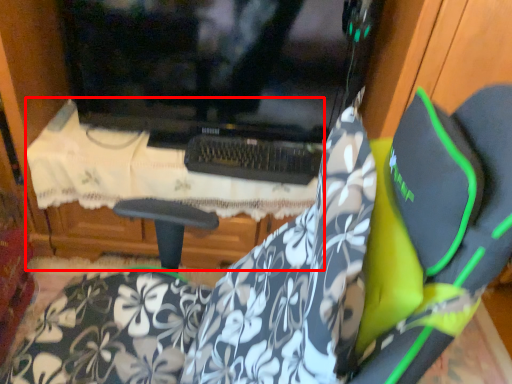
Question: From the image's perspective, where is table (annotated by the red box) located relative to fabric?

Choices:
 (A) above
 (B) below

Answer: (A)